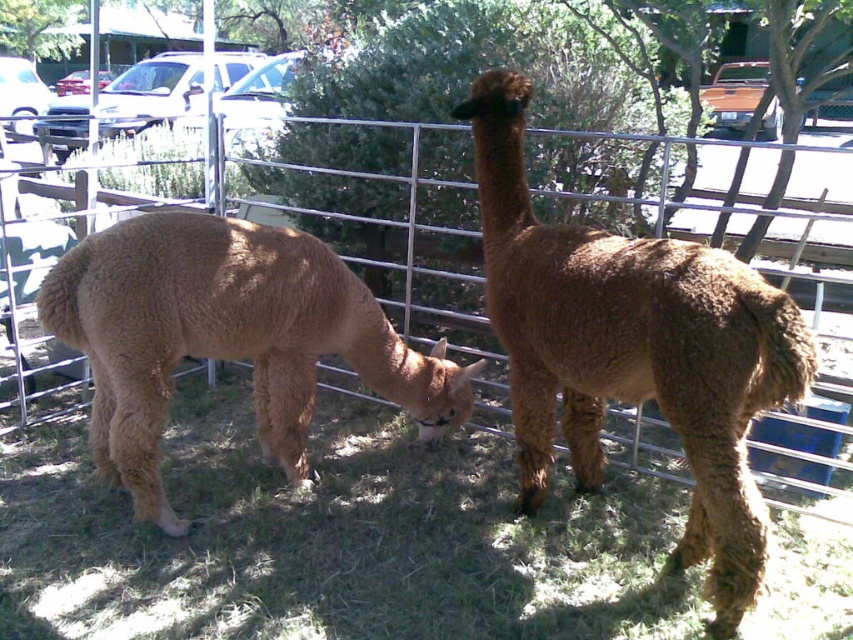
Question: Which of these objects is positioned farthest from the brown woolly alpaca at center?

Choices:
 (A) green soft grass at center
 (B) brown woolen camel at center

Answer: (B)

Question: Which object is the farthest from the green soft grass at center?

Choices:
 (A) brown woolly alpaca at center
 (B) brown woolen camel at center
 (C) metallic silver fence at center

Answer: (C)

Question: Does green soft grass at center appear on the right side of brown woolly alpaca at center?

Choices:
 (A) yes
 (B) no

Answer: (B)

Question: Does brown woolen camel at center come in front of metallic silver fence at center?

Choices:
 (A) yes
 (B) no

Answer: (A)

Question: Which object appears closest to the camera in this image?

Choices:
 (A) metallic silver fence at center
 (B) brown woolly alpaca at center
 (C) brown woolen camel at center

Answer: (B)

Question: Does green soft grass at center lie behind brown woolen camel at center?

Choices:
 (A) yes
 (B) no

Answer: (B)